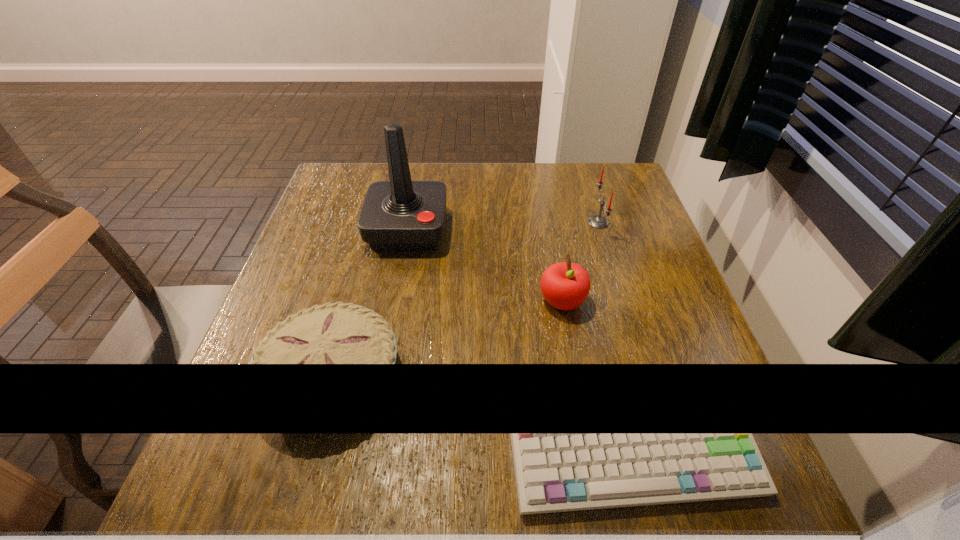
Identify the location of vacant space located on the left of the second object from right to left. This screenshot has height=540, width=960. (495, 302).

This screenshot has width=960, height=540. Identify the location of free space located on the back of the nearest object. (369, 240).

Locate an element on the screen. The height and width of the screenshot is (540, 960). joystick that is positioned at the far edge is located at coordinates (398, 215).

Locate an element on the screen. The image size is (960, 540). candle at the far edge is located at coordinates (597, 221).

This screenshot has height=540, width=960. I want to click on joystick that is at the left edge, so click(x=398, y=215).

Image resolution: width=960 pixels, height=540 pixels. I want to click on pie that is at the left edge, so tap(339, 333).

Find the location of a particular element. The width and height of the screenshot is (960, 540). object that is at the right edge is located at coordinates (597, 221).

Identify the location of object that is at the far left corner. (398, 215).

Locate an element on the screen. The image size is (960, 540). object at the far right corner is located at coordinates (597, 221).

I want to click on vacant space at the far edge of the desktop, so click(x=485, y=180).